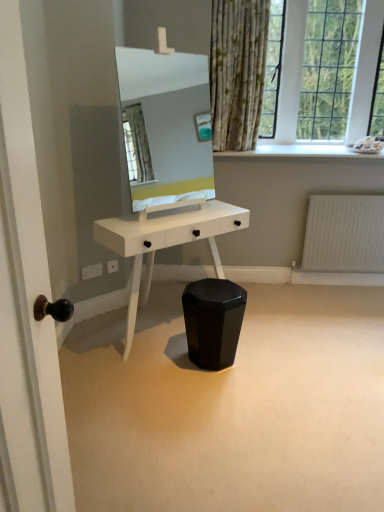
I want to click on free spot above black glossy stool at center (from a real-world perspective), so (251, 349).